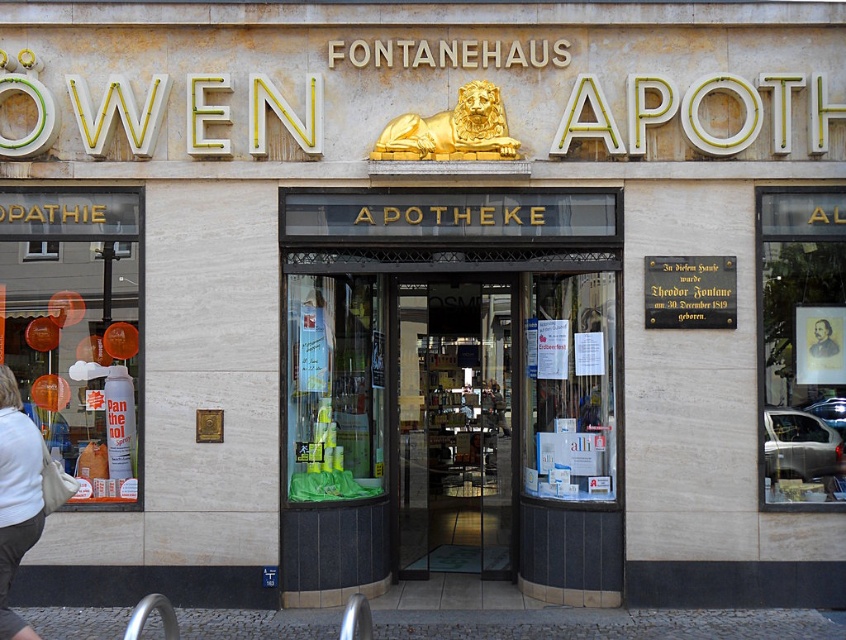
Can you confirm if matte glass door at center is smaller than matte gold frame at upper right?

No, matte glass door at center is not smaller than matte gold frame at upper right.

Between matte glass door at center and matte gold frame at upper right, which one has more height?

matte glass door at center

Does point (391, 282) lie behind point (834, 484)?

That is True.

This screenshot has width=846, height=640. Find the location of `matte glass door at center`. matte glass door at center is located at coordinates (451, 388).

The height and width of the screenshot is (640, 846). Describe the element at coordinates (801, 342) in the screenshot. I see `matte gold frame at upper right` at that location.

Measure the distance between matte gold frame at upper right and white cotton shirt at lower left.

matte gold frame at upper right is 18.80 feet from white cotton shirt at lower left.

In order to click on matte gold frame at upper right in this screenshot , I will do `click(801, 342)`.

The height and width of the screenshot is (640, 846). Identify the location of translucent plastic bottles at left. (75, 326).

Measure the distance between point (0, 353) and camera.

Point (0, 353) is 8.70 meters from camera.

The width and height of the screenshot is (846, 640). I want to click on translucent plastic bottles at left, so click(75, 326).